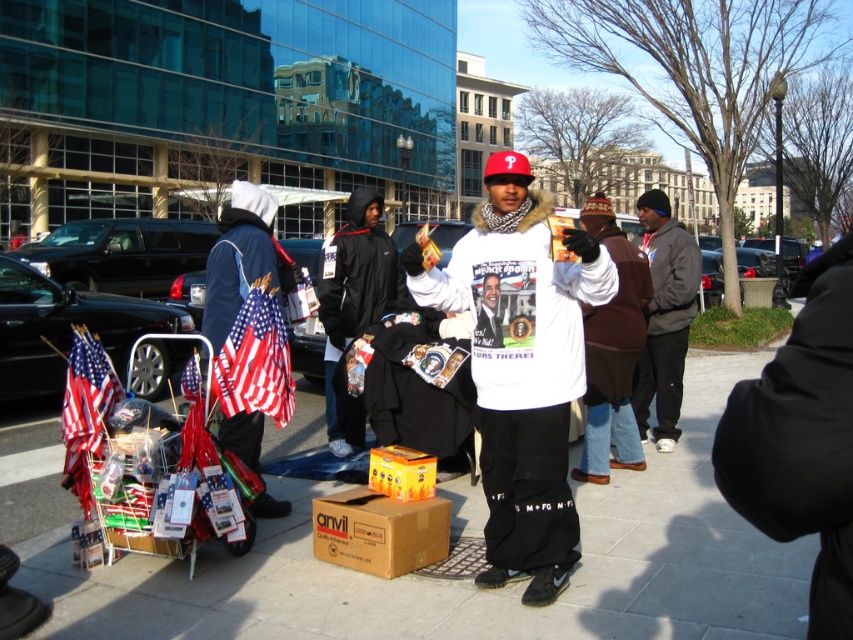
Question: Can you confirm if brown fuzzy vest at center is bigger than orange cardboard box at center?

Choices:
 (A) yes
 (B) no

Answer: (A)

Question: Which of the following is the closest to the observer?

Choices:
 (A) brown fuzzy vest at center
 (B) smooth concrete sidewalk at center

Answer: (B)

Question: Observing the image, what is the correct spatial positioning of blue denim jacket at left in reference to brown cardboard box at center?

Choices:
 (A) below
 (B) above

Answer: (B)

Question: Which of the following is the closest to the observer?

Choices:
 (A) (360, 314)
 (B) (94, 400)

Answer: (B)

Question: Can you confirm if brown cardboard box at center is thinner than orange cardboard box at center?

Choices:
 (A) yes
 (B) no

Answer: (B)

Question: Which object is farther from the camera taking this photo?

Choices:
 (A) american flag at left
 (B) white fleece sweatshirt at center
 (C) black hooded sweatshirt at center

Answer: (C)